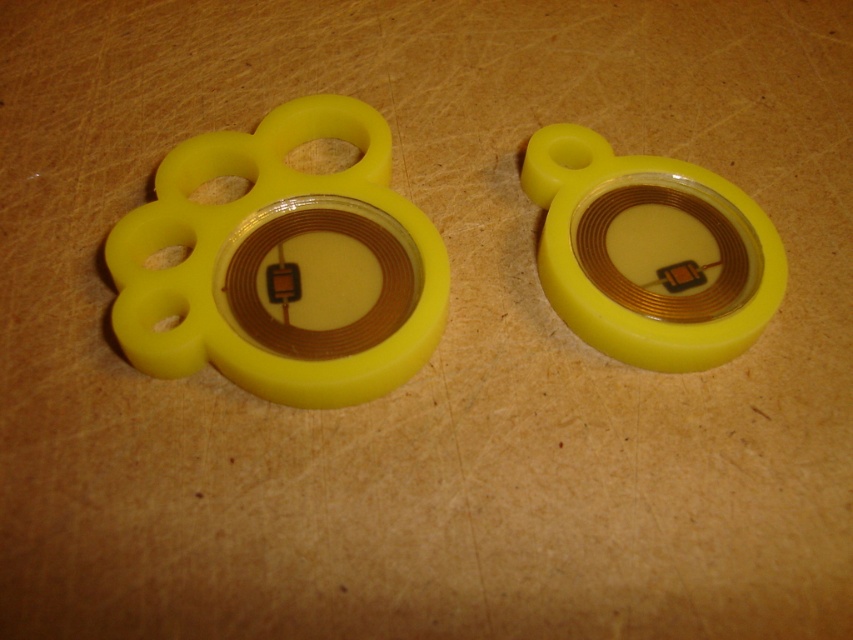
You are an engineer inspecting a workbench with two yellow, paw shaped objects. You need to locate the exact position of the point marked as point [283,260]. Based on the scene description, where would this point be located?

The point [283,260] corresponds to the matte yellow paw at center, so it is located at the center of the paw.

You are positioning a new tool on a workbench and need to place it exactly at the center of the wooden surface. The existing matte yellow paw at center is currently at coordinates point 0.408, 0.333. Can you confirm if this object is already centered on the workbench?

The matte yellow paw at center is located at point (283, 260). To determine if it is centered, we need to know the workbench dimensions. Since the scene description mentions it is a workbench with scratches and wear but does not provide exact measurements, we cannot confirm if the coordinates align with the center without additional information.